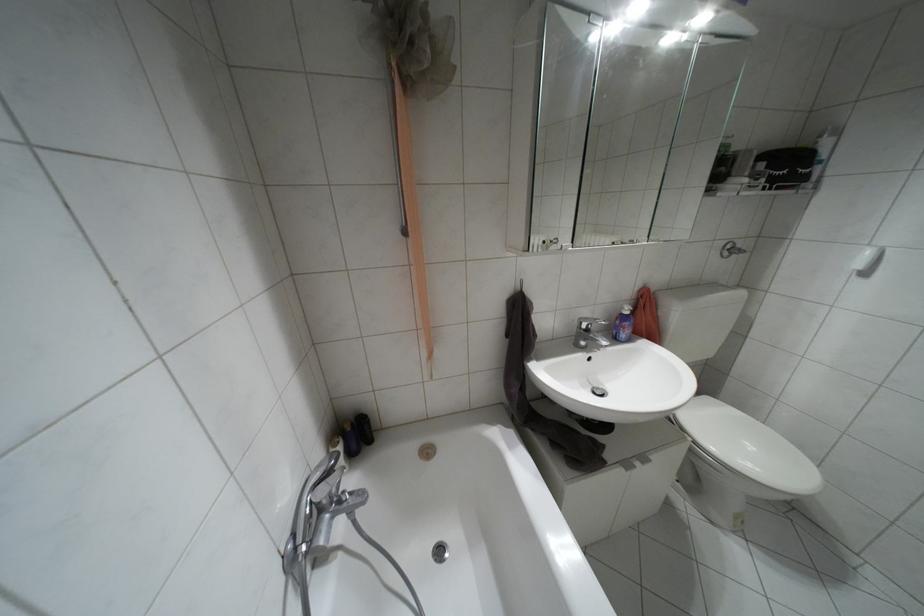
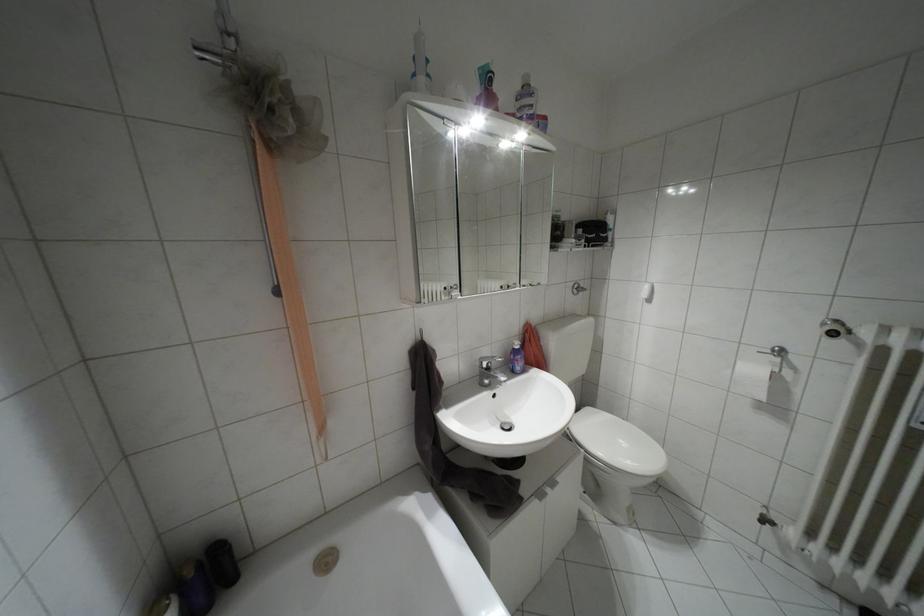
Question: The camera is either moving clockwise (left) or counter-clockwise (right) around the object. The first image is from the beginning of the video and the second image is from the end. Is the camera moving left or right when shooting the video?

Choices:
 (A) Left
 (B) Right

Answer: (A)